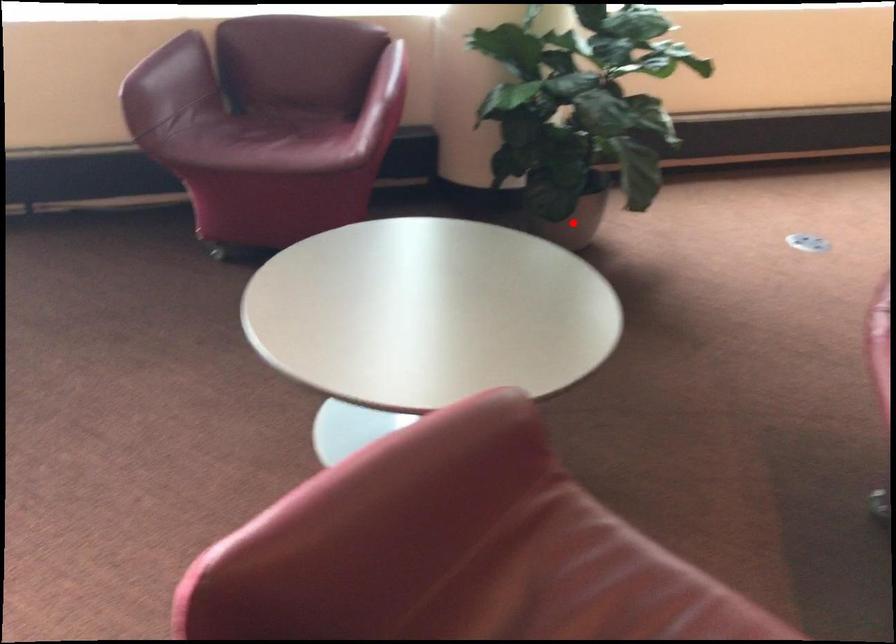
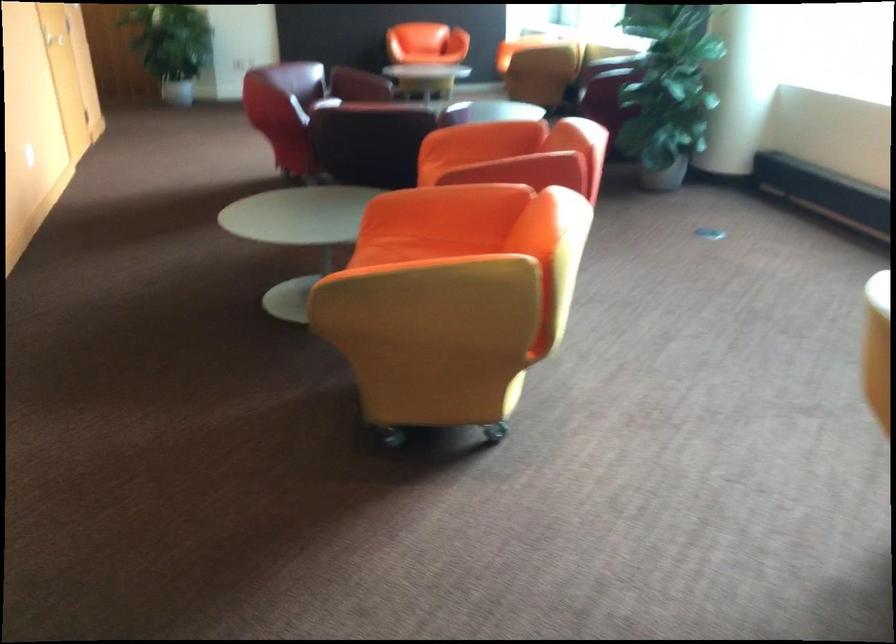
The point at the highlighted location is marked in the first image. Where is the corresponding point in the second image?

(643, 158)